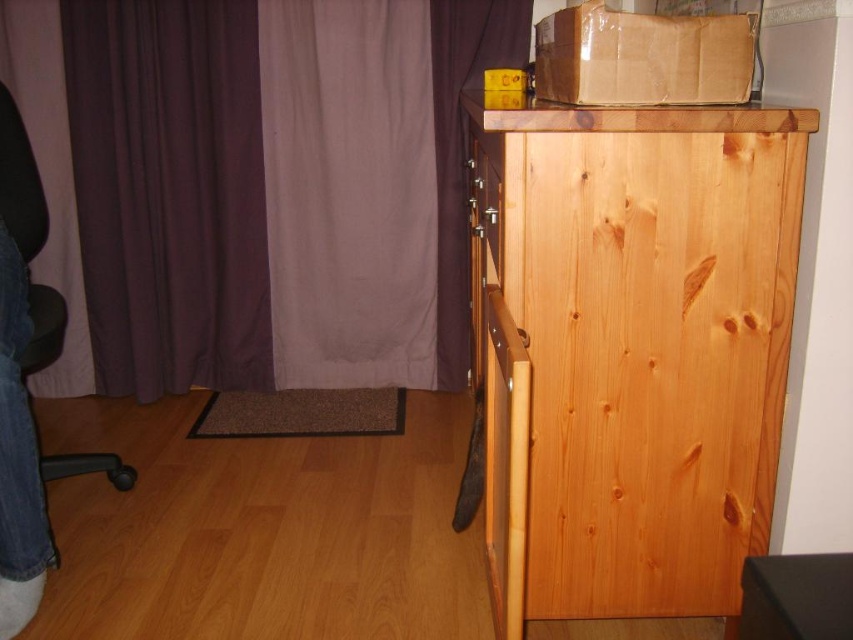
You are standing in the room and want to move from the purple fabric curtain at upper left to the black mesh chair at left. Which object is closer to you as you move towards the chair?

The purple fabric curtain at upper left is closer to you than the black mesh chair at left as you move towards the chair, so you will encounter it first.

You are trying to decide whether to place a new lamp on the natural wood dresser at upper right or the denim jeans at lower left. Based on their sizes, which surface can better accommodate the lamp?

The natural wood dresser at upper right is much taller than the denim jeans at lower left, so the lamp would be more stable and appropriately sized on the natural wood dresser at upper right.